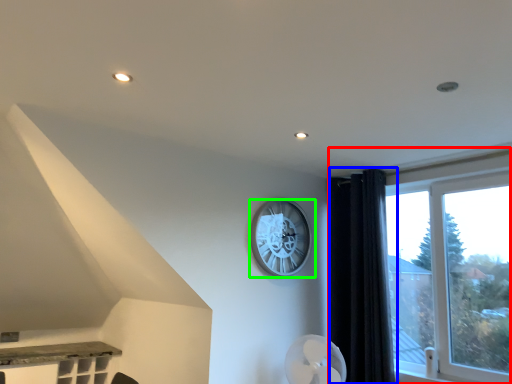
Question: Which object is the closest to the window (highlighted by a red box)? Choose among these: curtain (highlighted by a blue box) or wall clock (highlighted by a green box).

Choices:
 (A) curtain
 (B) wall clock

Answer: (A)